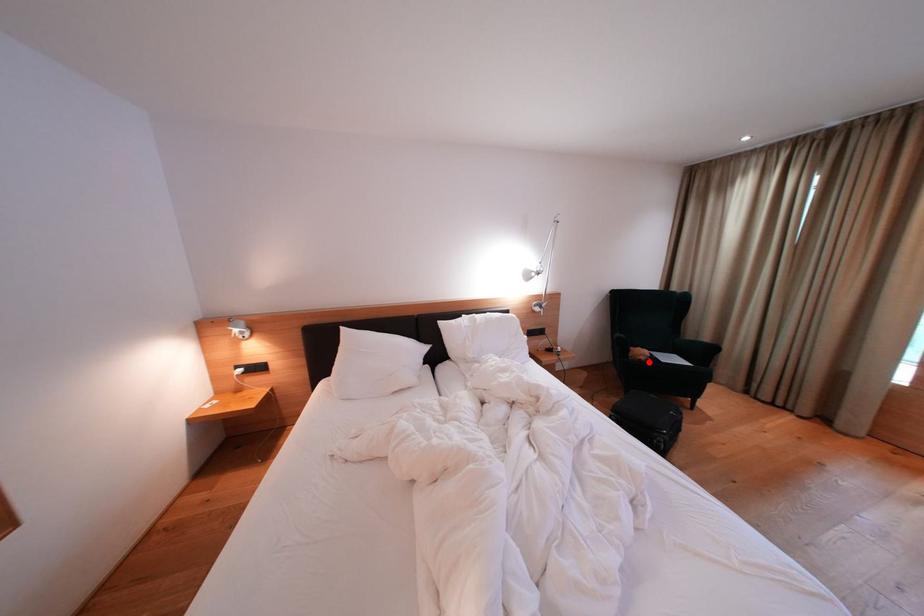
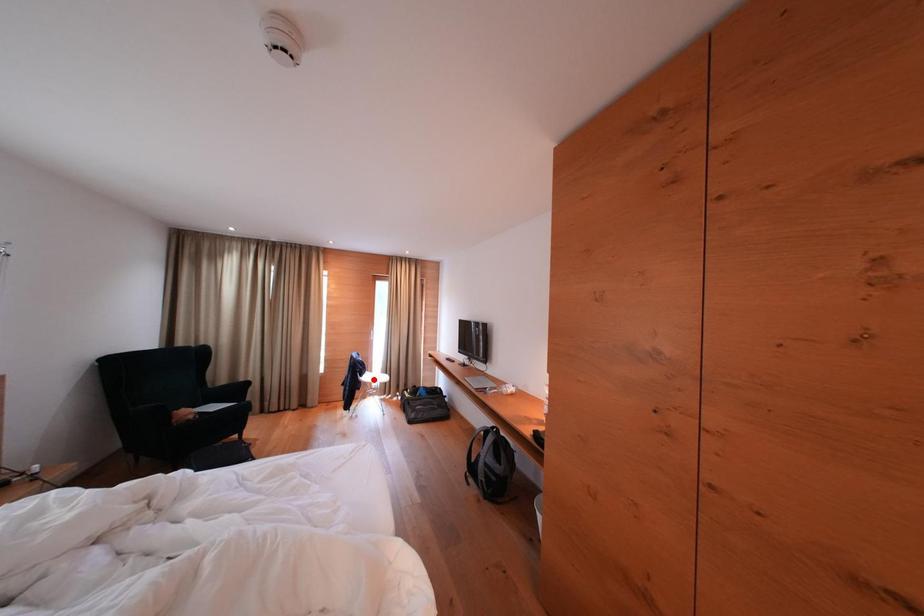
I am providing you with two images of the same scene from different viewpoints. A red point is marked on the first image and another point is marked on the second image. Does the point marked in image1 correspond to the same location as the one in image2?

No